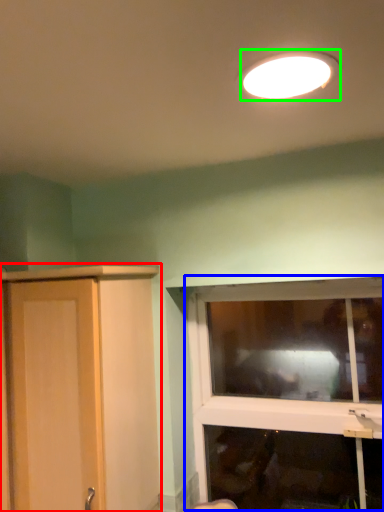
Question: Which object is the closest to the cupboard (highlighted by a red box)? Choose among these: window (highlighted by a blue box) or lamp (highlighted by a green box).

Choices:
 (A) window
 (B) lamp

Answer: (B)